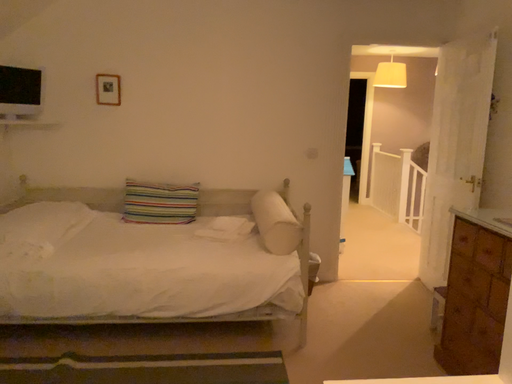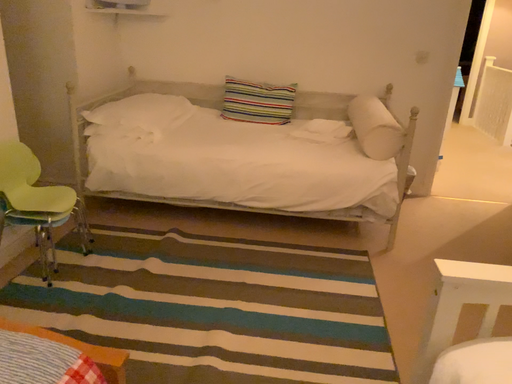
Question: Which way did the camera rotate in the video?

Choices:
 (A) rotated right
 (B) rotated left

Answer: (B)